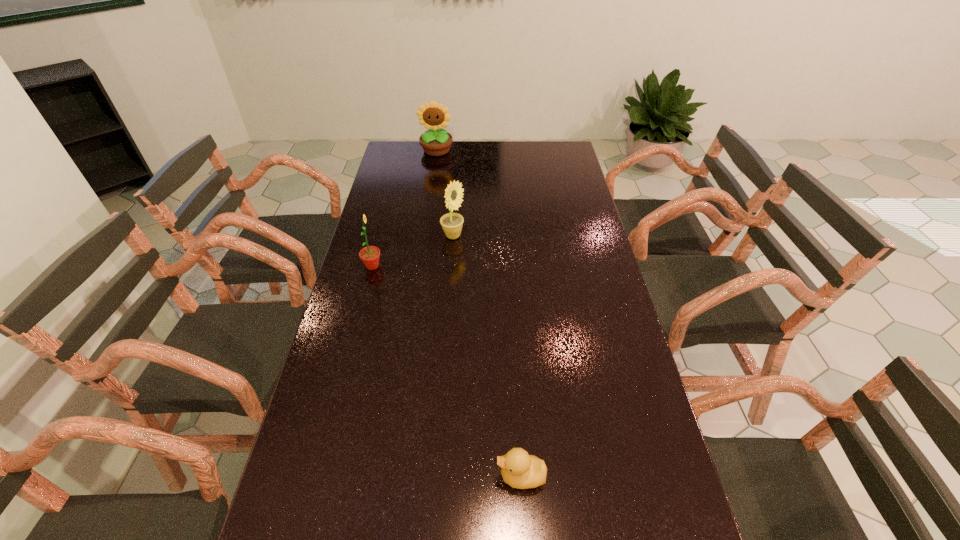
Identify the location of blank region between the rightmost object and the second farthest sunflower. (487, 356).

You are a GUI agent. You are given a task and a screenshot of the screen. Output one action in this format:
    pyautogui.click(x=<x>, y=<y>)
    Task: Click on the free point between the farthest object and the nearest sunflower
    The width and height of the screenshot is (960, 540).
    Given the screenshot: What is the action you would take?
    pyautogui.click(x=404, y=208)

Where is `vacant space that's between the leftmost object and the third nearest object`? vacant space that's between the leftmost object and the third nearest object is located at coordinates (413, 251).

Where is `free space between the shortest object and the second nearest sunflower`? Image resolution: width=960 pixels, height=540 pixels. free space between the shortest object and the second nearest sunflower is located at coordinates (487, 356).

Identify the location of free space between the second farthest sunflower and the farthest sunflower. The width and height of the screenshot is (960, 540). (444, 193).

Find the location of a particular element. The width and height of the screenshot is (960, 540). free point between the rightmost object and the leftmost object is located at coordinates [x=446, y=371].

Locate an element on the screen. The image size is (960, 540). vacant area that lies between the farthest sunflower and the nearest sunflower is located at coordinates (404, 208).

At what (x,y) coordinates should I click in order to perform the action: click on free point between the second farthest sunflower and the shortest object. Please return your answer as a coordinate pair (x, y). This screenshot has height=540, width=960. Looking at the image, I should click on (487, 356).

Where is `object that stands as the closest to the farthest sunflower`? object that stands as the closest to the farthest sunflower is located at coordinates (452, 223).

Select which object appears as the third closest to the leftmost sunflower. Please provide its 2D coordinates. Your answer should be formatted as a tuple, i.e. [(x, y)], where the tuple contains the x and y coordinates of a point satisfying the conditions above.

[(519, 470)]